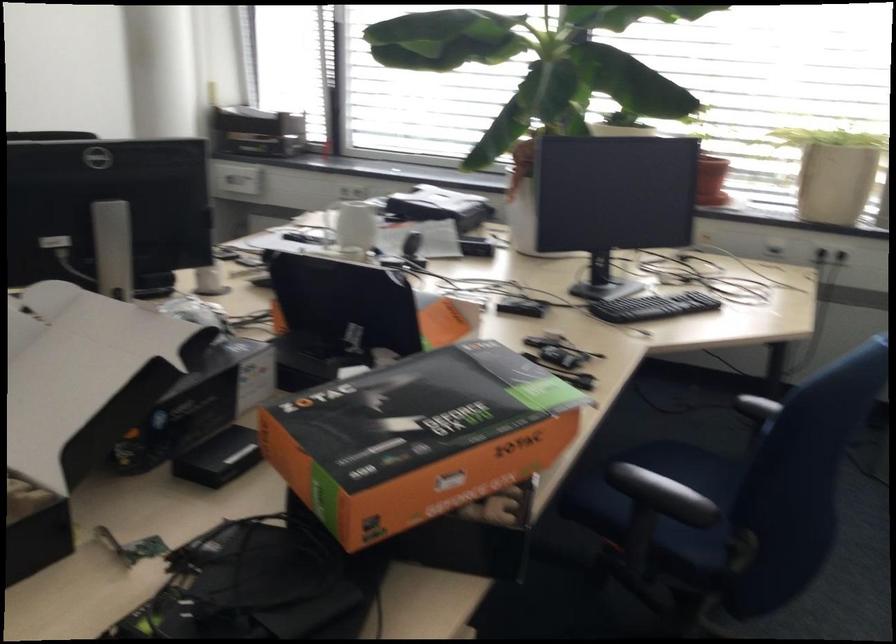
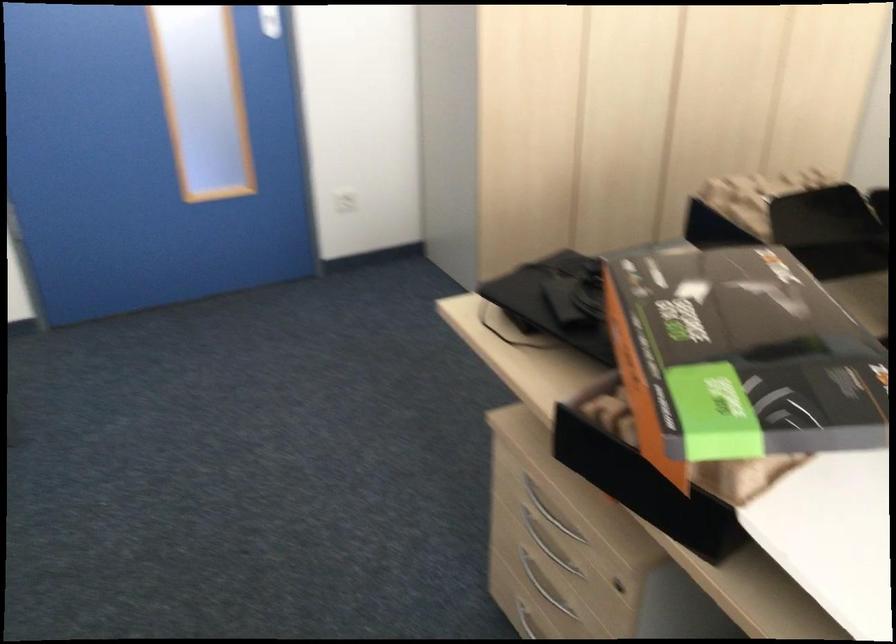
Where in the second image is the point corresponding to point 453,395 from the first image?

(738, 357)